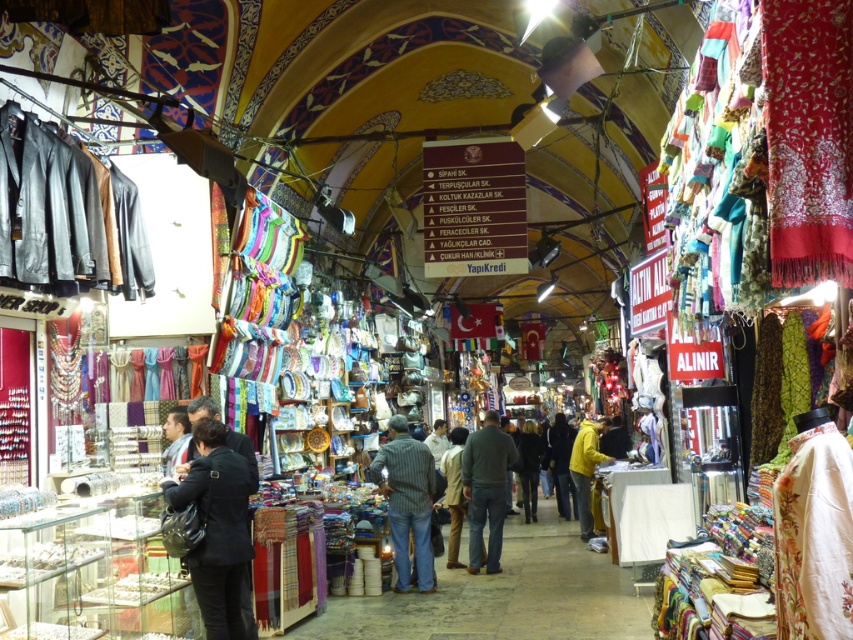
Is light brown leather jacket at center below yellow fabric at center?

Actually, light brown leather jacket at center is above yellow fabric at center.

Can you confirm if light brown leather jacket at center is smaller than yellow fabric at center?

Yes, light brown leather jacket at center is smaller than yellow fabric at center.

Does point (445, 476) come closer to viewer compared to point (554, 445)?

Yes, it is.

Locate an element on the screen. The height and width of the screenshot is (640, 853). light brown leather jacket at center is located at coordinates (454, 492).

Between point (381, 458) and point (573, 506), which one is positioned behind?

Point (573, 506)

Which is in front, point (427, 552) or point (555, 429)?

Positioned in front is point (427, 552).

Between point (425, 548) and point (567, 515), which one is positioned behind?

Positioned behind is point (567, 515).

You are a GUI agent. You are given a task and a screenshot of the screen. Output one action in this format:
    pyautogui.click(x=<x>, y=<y>)
    Task: Click on the striped fabric at center
    
    Given the screenshot: What is the action you would take?
    pyautogui.click(x=407, y=500)

Between dark blue fabric at center and striped fabric at center, which one is positioned lower?

striped fabric at center is lower down.

Consider the image. Is dark blue fabric at center shorter than striped fabric at center?

Yes, dark blue fabric at center is shorter than striped fabric at center.

Between point (210, 529) and point (383, 484), which one is positioned in front?

Point (210, 529) is more forward.

This screenshot has height=640, width=853. What are the coordinates of `dark blue fabric at center` in the screenshot? It's located at (218, 528).